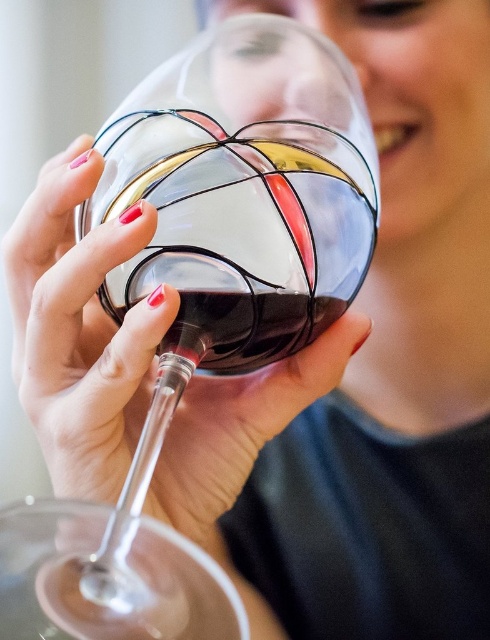
Question: Which of the following is the closest to the observer?

Choices:
 (A) dark glass wine at center
 (B) clear glass wine glass at center

Answer: (B)

Question: Can you confirm if clear glass wine glass at center is positioned to the right of dark glass wine at center?

Choices:
 (A) yes
 (B) no

Answer: (A)

Question: Which of the following is the closest to the observer?

Choices:
 (A) dark glass wine at center
 (B) clear glass wine glass at center

Answer: (B)

Question: Can you confirm if clear glass wine glass at center is wider than dark glass wine at center?

Choices:
 (A) no
 (B) yes

Answer: (B)

Question: Does clear glass wine glass at center appear over dark glass wine at center?

Choices:
 (A) yes
 (B) no

Answer: (B)